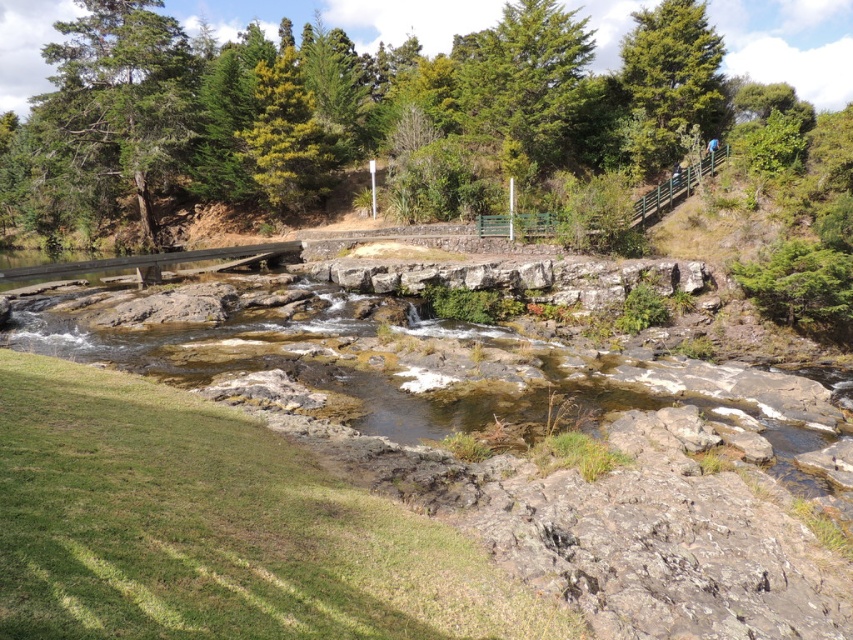
You are a hiker who wants to take a photo of both the green rough bark tree at upper left and the green textured tree at upper right. Which tree should you stand closer to in order to capture both in a single frame?

You should stand closer to the green textured tree at upper right because it is shorter than the green rough bark tree at upper left, allowing both to fit within the camera frame when positioned appropriately.

You are a hiker planning to cross the rocky stream at center. There is a green textured tree at upper center nearby. Which one is wider in terms of their physical dimensions?

The rocky stream at center is wider than the green textured tree at upper center.

You are standing at the wooden bridge and looking towards the stream. You see two points marked in the image. Which point, point (589, 356) or point (549, 70), is closer to you?

Point (589, 356) is closer to you because it is in front of point (549, 70).